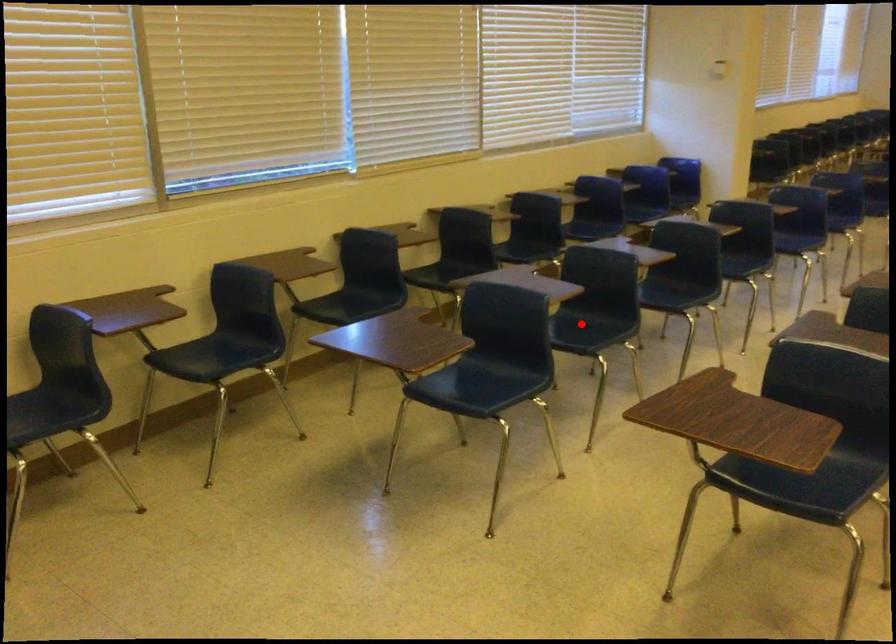
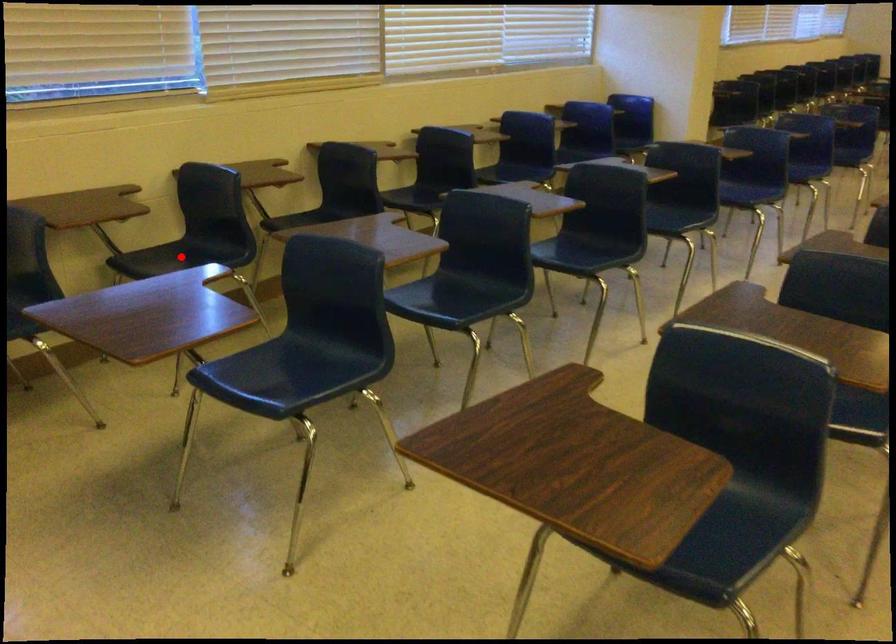
I am providing you with two images of the same scene from different viewpoints. A red point is marked on the first image and another point is marked on the second image. Is the marked point in image1 the same physical position as the marked point in image2?

No